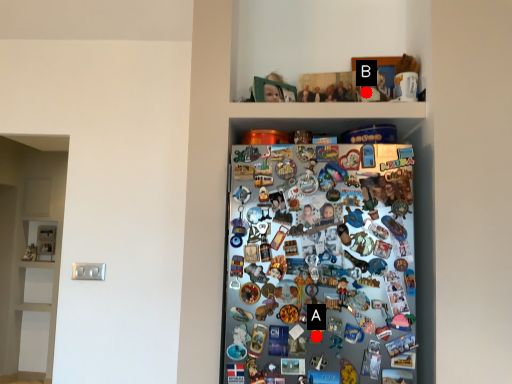
Question: Two points are circled on the image, labeled by A and B beside each circle. Which of the following is the farthest from the observer?

Choices:
 (A) A is further
 (B) B is further

Answer: (B)